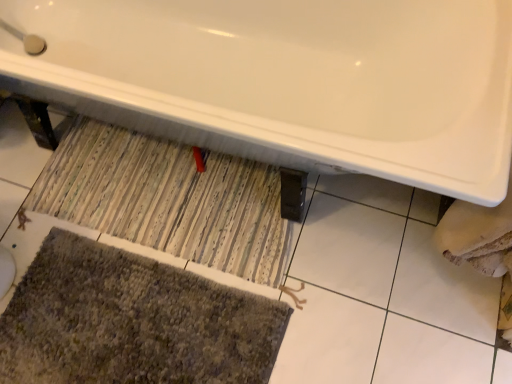
Describe the element at coordinates (132, 322) in the screenshot. The width and height of the screenshot is (512, 384). I see `textured gray bath mat at lower left` at that location.

Where is `textured gray bath mat at lower left`? This screenshot has width=512, height=384. textured gray bath mat at lower left is located at coordinates (132, 322).

From a real-world perspective, who is located lower, striped fabric doormat at center or textured gray bath mat at lower left?

In real-world perspective, textured gray bath mat at lower left is lower.

Visually, is striped fabric doormat at center positioned to the left or to the right of textured gray bath mat at lower left?

A: Based on their positions, striped fabric doormat at center is located to the right of textured gray bath mat at lower left.

Does striped fabric doormat at center come behind textured gray bath mat at lower left?

That is True.

Is striped fabric doormat at center next to textured gray bath mat at lower left?

No, striped fabric doormat at center is not touching textured gray bath mat at lower left.

Between white glossy bathtub at upper center and textured gray bath mat at lower left, which one is positioned in front?

Positioned in front is white glossy bathtub at upper center.

In the scene shown: From a real-world perspective, is white glossy bathtub at upper center beneath textured gray bath mat at lower left?

Actually, white glossy bathtub at upper center is physically above textured gray bath mat at lower left in the real world.

Can you confirm if white glossy bathtub at upper center is wider than textured gray bath mat at lower left?

Indeed, white glossy bathtub at upper center has a greater width compared to textured gray bath mat at lower left.

In terms of height, does striped fabric doormat at center look taller or shorter compared to white glossy bathtub at upper center?

Considering their sizes, striped fabric doormat at center has less height than white glossy bathtub at upper center.

From the picture: From the image's perspective, is striped fabric doormat at center under white glossy bathtub at upper center?

Yes, from the image's perspective, striped fabric doormat at center is below white glossy bathtub at upper center.

Based on the photo, between striped fabric doormat at center and white glossy bathtub at upper center, which one is positioned in front?

white glossy bathtub at upper center is more forward.

Does striped fabric doormat at center turn towards white glossy bathtub at upper center?

Yes, striped fabric doormat at center is turned towards white glossy bathtub at upper center.

Could you tell me if textured gray bath mat at lower left is facing striped fabric doormat at center?

No, textured gray bath mat at lower left is not oriented towards striped fabric doormat at center.

Is textured gray bath mat at lower left inside the boundaries of striped fabric doormat at center, or outside?

textured gray bath mat at lower left is located beyond the bounds of striped fabric doormat at center.

From a real-world perspective, which object stands above the other?

striped fabric doormat at center is physically above.

In the image, there is a textured gray bath mat at lower left. Find the location of `doormat above it (from the image's perspective)`. doormat above it (from the image's perspective) is located at coordinates (167, 199).

Does point (74, 284) lie behind point (240, 83)?

No, (74, 284) is closer to viewer.

Considering the relative positions of textured gray bath mat at lower left and white glossy bathtub at upper center in the image provided, is textured gray bath mat at lower left behind white glossy bathtub at upper center?

Yes, it is behind white glossy bathtub at upper center.

Does textured gray bath mat at lower left appear on the left side of white glossy bathtub at upper center?

Yes.

Is textured gray bath mat at lower left spatially inside white glossy bathtub at upper center, or outside of it?

textured gray bath mat at lower left lies outside white glossy bathtub at upper center.

In the scene shown: Looking at their sizes, would you say white glossy bathtub at upper center is wider or thinner than striped fabric doormat at center?

In the image, white glossy bathtub at upper center appears to be wider than striped fabric doormat at center.

From the image's perspective, between white glossy bathtub at upper center and striped fabric doormat at center, who is located below?

striped fabric doormat at center, from the image's perspective.

Would you say white glossy bathtub at upper center is a long distance from striped fabric doormat at center?

No, white glossy bathtub at upper center is not far away from striped fabric doormat at center.

Could you tell me if white glossy bathtub at upper center is facing striped fabric doormat at center?

No, white glossy bathtub at upper center is not aimed at striped fabric doormat at center.

The height and width of the screenshot is (384, 512). I want to click on doormat above the textured gray bath mat at lower left (from the image's perspective), so point(167,199).

I want to click on bath mat on the left side of white glossy bathtub at upper center, so click(x=132, y=322).

From the image, which object appears to be farther from textured gray bath mat at lower left, white glossy bathtub at upper center or striped fabric doormat at center?

The object further to textured gray bath mat at lower left is white glossy bathtub at upper center.

When comparing their distances from textured gray bath mat at lower left, does striped fabric doormat at center or white glossy bathtub at upper center seem further?

Based on the image, white glossy bathtub at upper center appears to be further to textured gray bath mat at lower left.

Looking at the image, which one is located closer to striped fabric doormat at center, textured gray bath mat at lower left or white glossy bathtub at upper center?

Among the two, textured gray bath mat at lower left is located nearer to striped fabric doormat at center.

When comparing their distances from white glossy bathtub at upper center, does striped fabric doormat at center or textured gray bath mat at lower left seem further?

textured gray bath mat at lower left lies further to white glossy bathtub at upper center than the other object.

Which object lies nearer to the anchor point striped fabric doormat at center, white glossy bathtub at upper center or textured gray bath mat at lower left?

textured gray bath mat at lower left.

From the image, which object appears to be farther from white glossy bathtub at upper center, textured gray bath mat at lower left or striped fabric doormat at center?

Based on the image, textured gray bath mat at lower left appears to be further to white glossy bathtub at upper center.

Image resolution: width=512 pixels, height=384 pixels. I want to click on doormat between white glossy bathtub at upper center and textured gray bath mat at lower left from top to bottom, so click(167, 199).